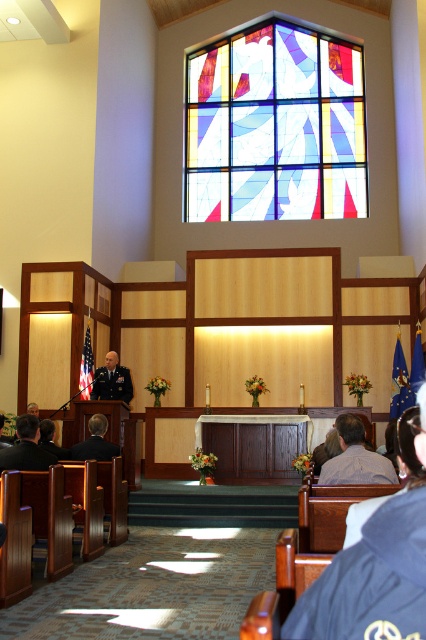
You are standing in the church and want to locate the point at coordinates point (275,125). Based on the scene description, where would this point be located?

The point (275,125) is located on the stained glass window at upper center.

You are a photographer standing at the back of the church. You need to capture a photo that includes both the dark blue uniform at lower left and the black uniform at center. Which uniform should you adjust your camera angle to focus on first to ensure both are in frame?

Since the dark blue uniform at lower left is narrower than the black uniform at center, you should focus on the black uniform at center first to ensure both fit within the camera frame.

You are a photographer planning to take a group photo of the attendees in the church. You notice the light brown leather jacket at lower center and the dark blue uniform at lower left. Which clothing item has a wider width?

The light brown leather jacket at lower center has a wider width than the dark blue uniform at lower left according to the description.